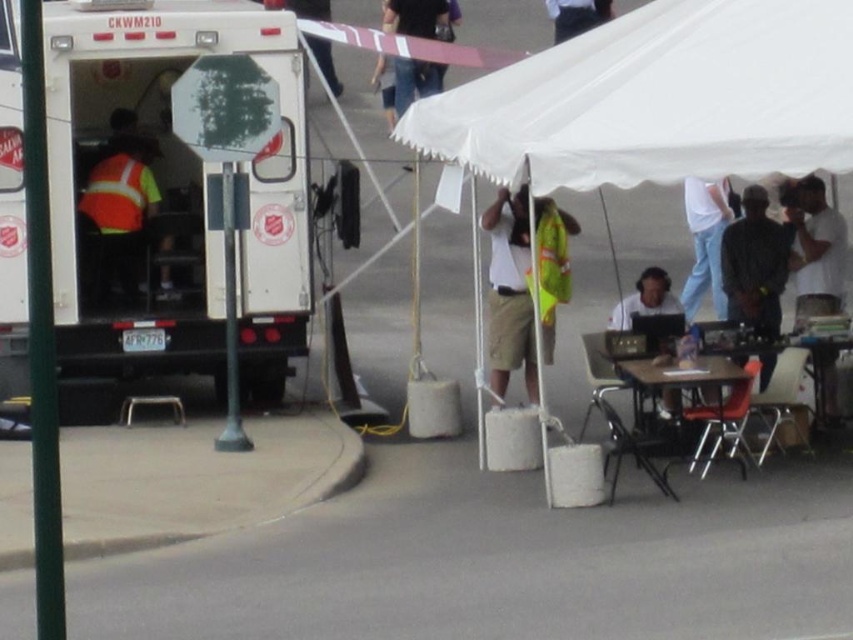
Does white fabric tent at center appear under matte black laptop at center?

Actually, white fabric tent at center is above matte black laptop at center.

Who is taller, white fabric tent at center or matte black laptop at center?

white fabric tent at center

What do you see at coordinates (659, 99) in the screenshot? I see `white fabric tent at center` at bounding box center [659, 99].

You are a GUI agent. You are given a task and a screenshot of the screen. Output one action in this format:
    pyautogui.click(x=<x>, y=<y>)
    Task: Click on the white fabric tent at center
    
    Given the screenshot: What is the action you would take?
    pyautogui.click(x=659, y=99)

From the picture: Who is shorter, white fabric canopy at upper center or matte black laptop at center?

With less height is matte black laptop at center.

Between white fabric canopy at upper center and matte black laptop at center, which one has more height?

Standing taller between the two is white fabric canopy at upper center.

Where is `white fabric canopy at upper center`? This screenshot has width=853, height=640. white fabric canopy at upper center is located at coordinates (659, 99).

Where is `white fabric canopy at upper center`? This screenshot has height=640, width=853. white fabric canopy at upper center is located at coordinates (659, 99).

Who is more forward, (759, 308) or (119, 216)?

Positioned in front is point (759, 308).

Which is more to the right, dark gray shirt at right or high-visibility reflective safety vest at left?

dark gray shirt at right

This screenshot has height=640, width=853. Describe the element at coordinates (755, 266) in the screenshot. I see `dark gray shirt at right` at that location.

Find the location of `dark gray shirt at right`. dark gray shirt at right is located at coordinates (755, 266).